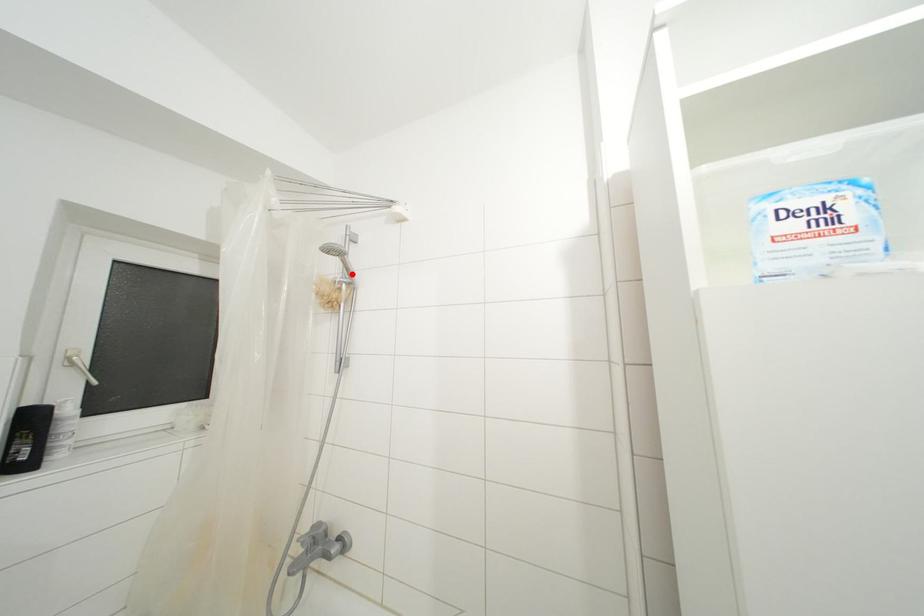
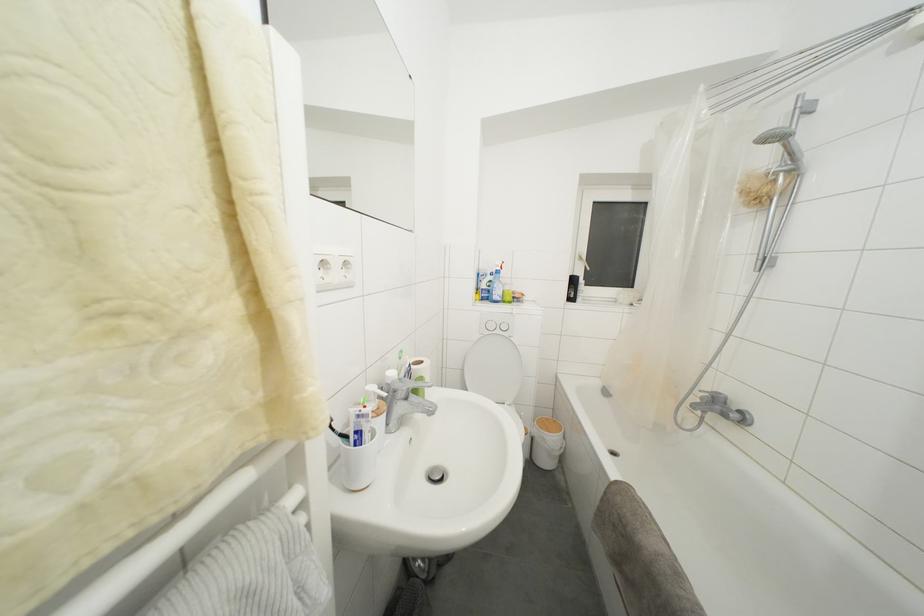
Find the pixel in the second image that matches the highlighted location in the first image.

(796, 159)